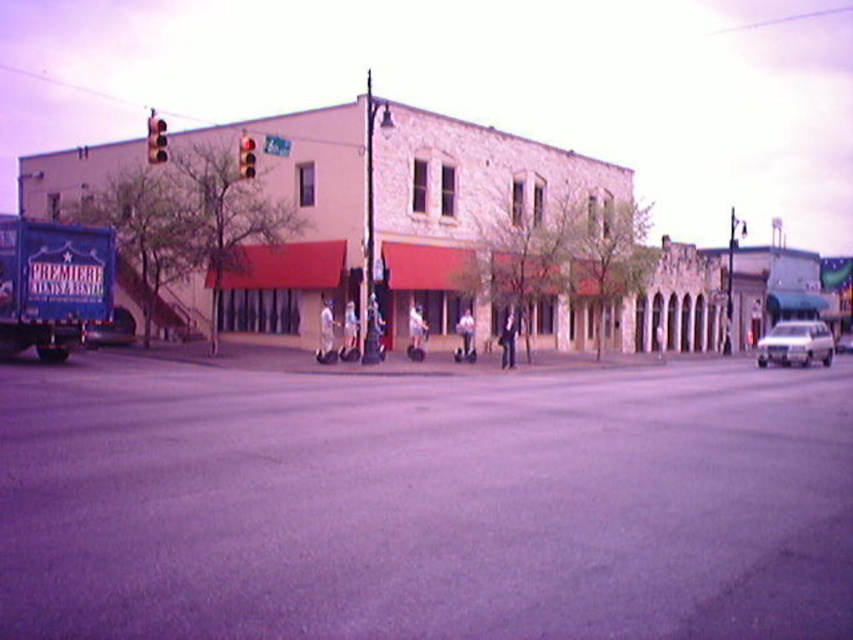
From the picture: Which of these two, silver metallic sedan at right or red glass traffic light at upper center, stands taller?

red glass traffic light at upper center is taller.

Is silver metallic sedan at right below red glass traffic light at upper center?

Yes, silver metallic sedan at right is below red glass traffic light at upper center.

This screenshot has height=640, width=853. In order to click on silver metallic sedan at right in this screenshot , I will do `click(795, 344)`.

Does dark asphalt road at center appear on the left side of silver metallic sedan at right?

Correct, you'll find dark asphalt road at center to the left of silver metallic sedan at right.

Does dark asphalt road at center have a greater height compared to silver metallic sedan at right?

No, dark asphalt road at center is not taller than silver metallic sedan at right.

Is point (245, 436) positioned after point (805, 355)?

No, (245, 436) is closer to viewer.

What are the coordinates of `dark asphalt road at center` in the screenshot? It's located at (424, 502).

Is dark asphalt road at center smaller than red glass traffic light at upper center?

No.

Does point (175, 586) come behind point (245, 179)?

No, (175, 586) is closer to viewer.

Who is more forward, (68, 541) or (244, 177)?

Positioned in front is point (68, 541).

What are the coordinates of `dark asphalt road at center` in the screenshot? It's located at (424, 502).